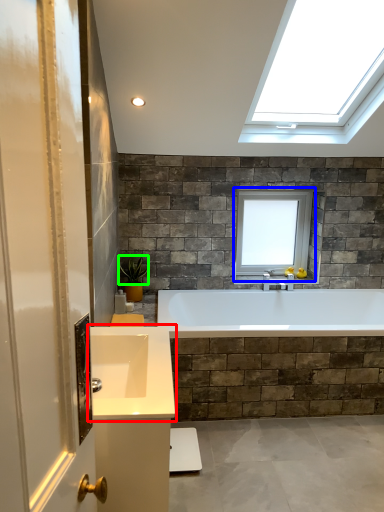
Question: Based on their relative distances, which object is nearer to sink (highlighted by a red box)? Choose from window (highlighted by a blue box) and plant (highlighted by a green box).

Choices:
 (A) window
 (B) plant

Answer: (B)